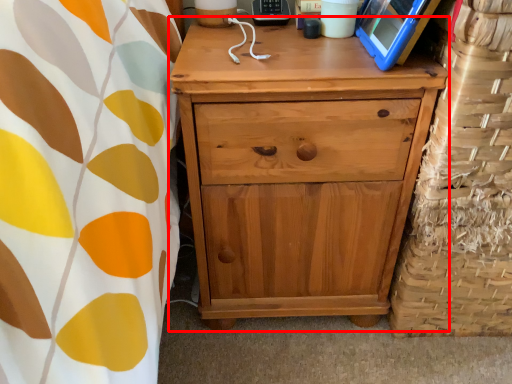
Question: From the image's perspective, what is the correct spatial positioning of chest of drawers (annotated by the red box) in reference to basket?

Choices:
 (A) above
 (B) below

Answer: (B)